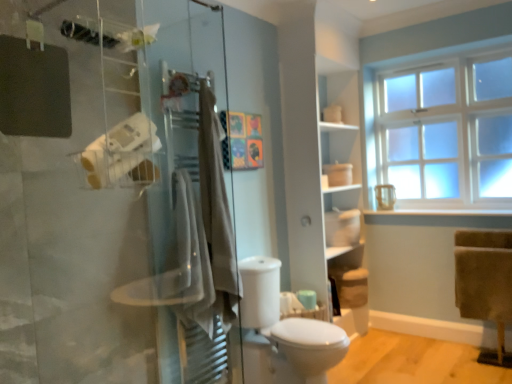
Question: From a real-world perspective, relative to beige cotton bath towel at center, which ranks as the second bath towel in back-to-front order, is white matte toilet paper at left vertically above or below?

Choices:
 (A) below
 (B) above

Answer: (B)

Question: Is white matte toilet paper at left inside the boundaries of beige cotton bath towel at center, which ranks as the second bath towel in back-to-front order, or outside?

Choices:
 (A) inside
 (B) outside

Answer: (B)

Question: Which object is the closest to the white glossy toilet at center?

Choices:
 (A) white matte shelf at center
 (B) beige cotton towel at center, the first bath towel positioned from the back
 (C) transparent glass shower door at left
 (D) white frosted glass window at upper right
 (E) beige cotton bath towel at center, the 1th bath towel when ordered from front to back

Answer: (B)

Question: Which is farther from the beige cotton bath towel at center, which ranks as the second bath towel in back-to-front order?

Choices:
 (A) white matte toilet paper at left
 (B) white glossy toilet at center
 (C) white frosted glass window at upper right
 (D) white matte shelf at center
 (E) transparent glass shower door at left

Answer: (C)